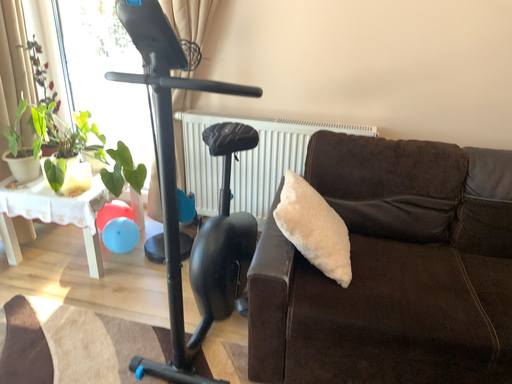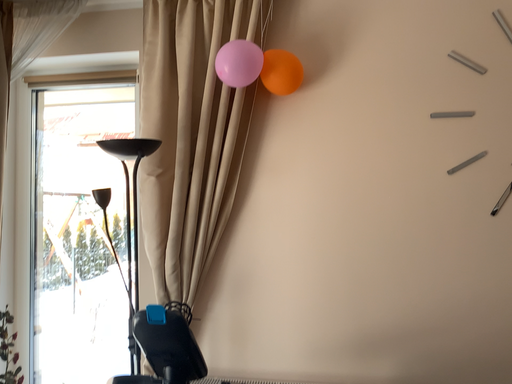
Question: Which way did the camera rotate in the video?

Choices:
 (A) rotated downward
 (B) rotated upward

Answer: (B)